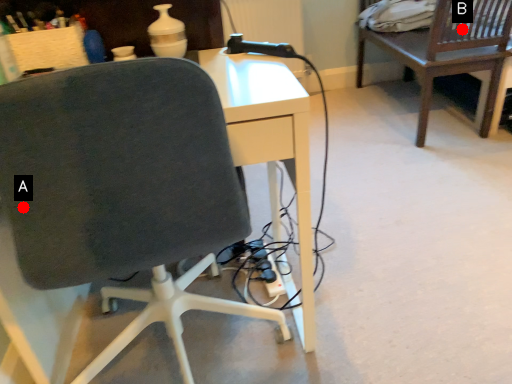
Question: Two points are circled on the image, labeled by A and B beside each circle. Which of the following is the farthest from the observer?

Choices:
 (A) A is further
 (B) B is further

Answer: (B)